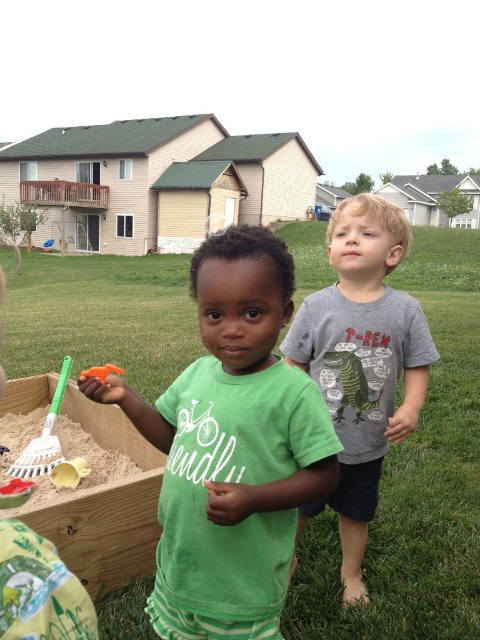
Question: Which point is farther to the camera?

Choices:
 (A) orange plastic shovel at lower left
 (B) green matte shirt at center

Answer: (A)

Question: Which point is closer to the camera taking this photo?

Choices:
 (A) (336, 282)
 (B) (101, 365)
 (C) (63, 374)
 (D) (55, 486)

Answer: (D)

Question: From the image, what is the correct spatial relationship of green matte shirt at center in relation to gray cotton t-shirt at center?

Choices:
 (A) right
 (B) left

Answer: (B)

Question: Is smooth yellow sand at lower left bigger than green plastic shovel at left?

Choices:
 (A) no
 (B) yes

Answer: (B)

Question: Considering the relative positions of green matte shirt at center and gray cotton t-shirt at center in the image provided, where is green matte shirt at center located with respect to gray cotton t-shirt at center?

Choices:
 (A) left
 (B) right

Answer: (A)

Question: Based on their relative distances, which object is nearer to the gray cotton t-shirt at center?

Choices:
 (A) green matte shirt at center
 (B) smooth yellow sand at lower left
 (C) orange plastic shovel at lower left

Answer: (A)